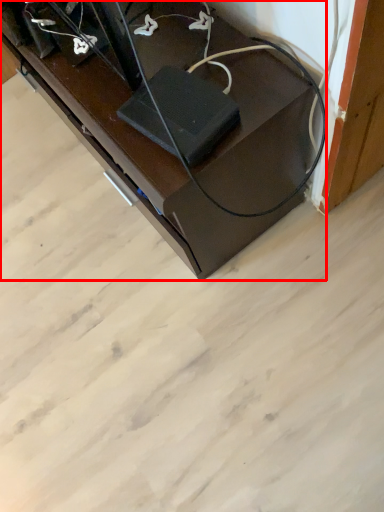
Question: In this image, where is furniture (annotated by the red box) located relative to wide?

Choices:
 (A) left
 (B) right

Answer: (A)